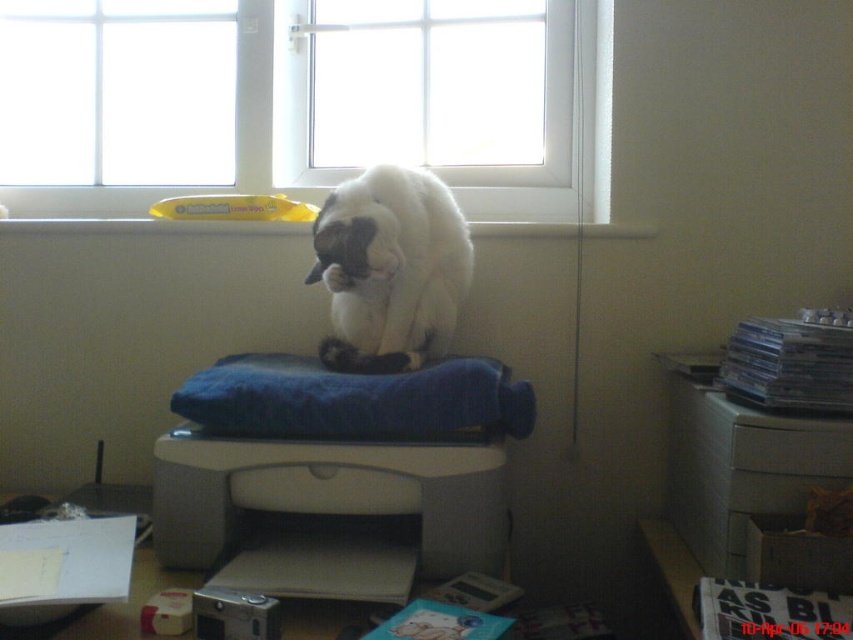
Can you confirm if white plastic window at upper center is smaller than gray matte printer at center?

Actually, white plastic window at upper center might be larger than gray matte printer at center.

Can you confirm if white plastic window at upper center is taller than gray matte printer at center?

Yes, white plastic window at upper center is taller than gray matte printer at center.

Locate an element on the screen. This screenshot has height=640, width=853. white plastic window at upper center is located at coordinates (440, 99).

Is white plastic window at upper center positioned at the back of transparent glass window at upper center?

No.

Which is in front, point (296, 68) or point (195, 131)?

Point (296, 68) is more forward.

Between point (387, 156) and point (154, 161), which one is positioned behind?

Positioned behind is point (154, 161).

At what (x,y) coordinates should I click in order to perform the action: click on white plastic window at upper center. Please return your answer as a coordinate pair (x, y). Looking at the image, I should click on (440, 99).

Is white plastic window at upper center to the right of white fluffy cat at center from the viewer's perspective?

Correct, you'll find white plastic window at upper center to the right of white fluffy cat at center.

Does point (509, 156) come farther from viewer compared to point (466, 252)?

Yes, it is behind point (466, 252).

Image resolution: width=853 pixels, height=640 pixels. Identify the location of white plastic window at upper center. (440, 99).